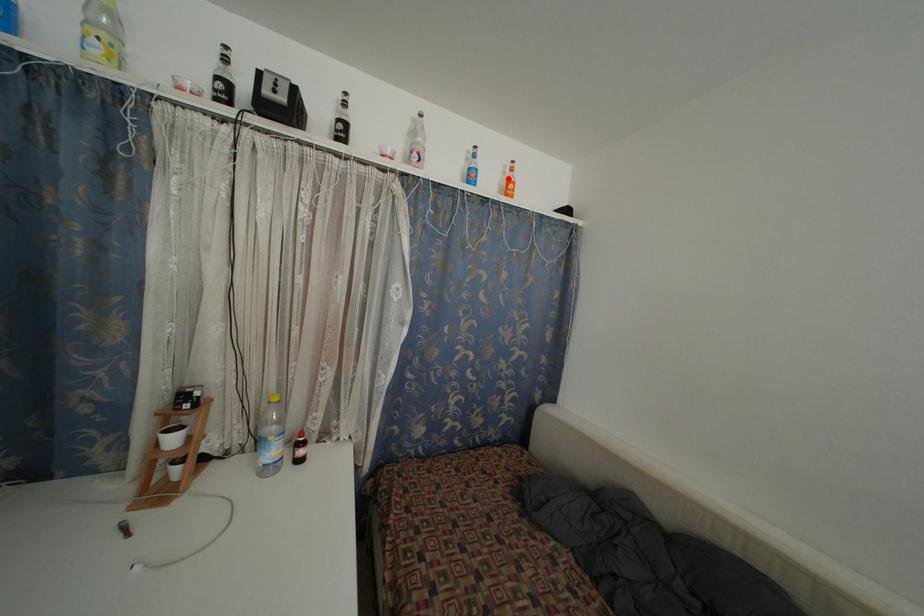
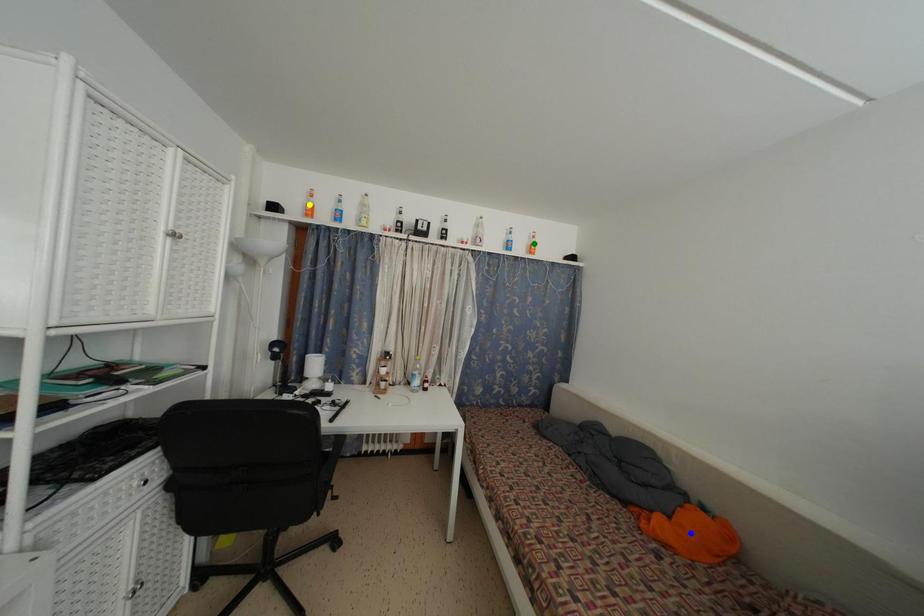
Question: I am providing you with two images of the same scene from different viewpoints. A red point is marked on the first image. You are given multiple points on the second image. In image 2, which mark is for the same physical point as the one in image 1?

Choices:
 (A) green point
 (B) blue point
 (C) yellow point

Answer: (A)